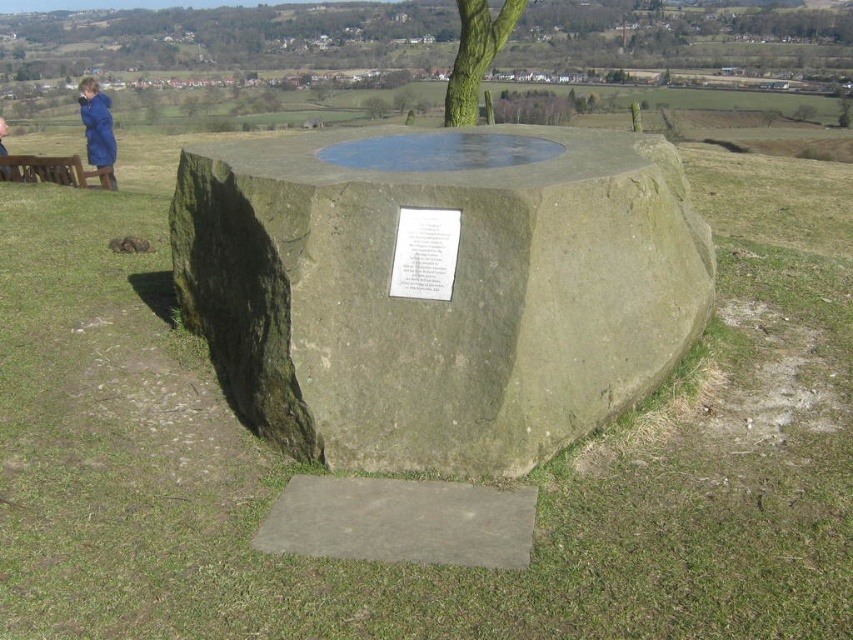
Question: Which object is positioned closest to the green stone monument at center?

Choices:
 (A) blue jacket at upper left
 (B) green textured tree at upper center

Answer: (B)

Question: Which point is farther to the camera?

Choices:
 (A) (473, 262)
 (B) (96, 100)
 (C) (20, 173)
 (D) (10, 170)

Answer: (B)

Question: In this image, where is green textured tree at upper center located relative to blue fabric jacket at upper left?

Choices:
 (A) right
 (B) left

Answer: (A)

Question: Is green stone monument at center to the left of blue jacket at upper left from the viewer's perspective?

Choices:
 (A) yes
 (B) no

Answer: (B)

Question: Is green textured tree at upper center smaller than brown wooden bench at left?

Choices:
 (A) no
 (B) yes

Answer: (B)

Question: Which of these objects is positioned closest to the blue fabric jacket at upper left?

Choices:
 (A) brown wooden bench at left
 (B) green stone monument at center

Answer: (A)